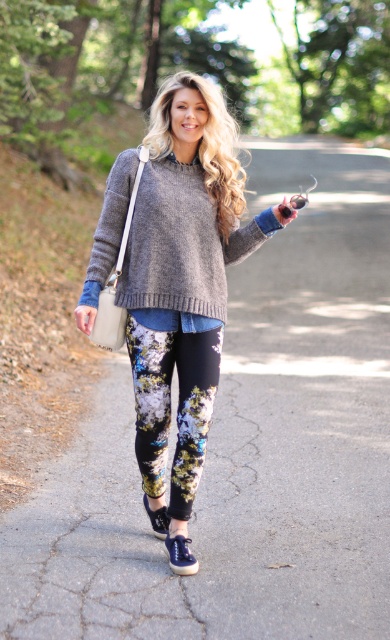
Between knit sweater at center and knit gray sweater at center, which one has less height?

With less height is knit gray sweater at center.

Is the position of knit sweater at center less distant than that of knit gray sweater at center?

Yes, it is.

Describe the element at coordinates (182, 289) in the screenshot. I see `knit sweater at center` at that location.

Find the location of a particular element. The image size is (390, 640). knit sweater at center is located at coordinates (182, 289).

Does knit sweater at center have a lesser width compared to floral printed leggings at center?

No.

Does point (171, 552) come behind point (184, 342)?

No, it is in front of (184, 342).

The image size is (390, 640). In order to click on knit sweater at center in this screenshot , I will do `click(182, 289)`.

Who is more forward, [193,209] or [191,504]?

Positioned in front is point [193,209].

Is knit gray sweater at center bigger than floral printed leggings at center?

Indeed, knit gray sweater at center has a larger size compared to floral printed leggings at center.

Who is more forward, (x=108, y=259) or (x=193, y=413)?

Point (x=193, y=413) is in front.

The image size is (390, 640). In order to click on knit gray sweater at center in this screenshot , I will do `click(179, 243)`.